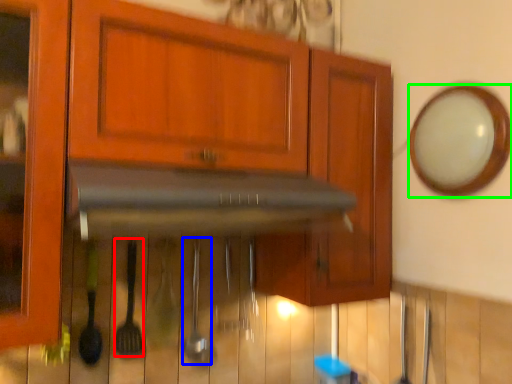
Question: Which object is the farthest from silverware (highlighted by a red box)? Choose among these: silverware (highlighted by a blue box) or mirror (highlighted by a green box).

Choices:
 (A) silverware
 (B) mirror

Answer: (B)